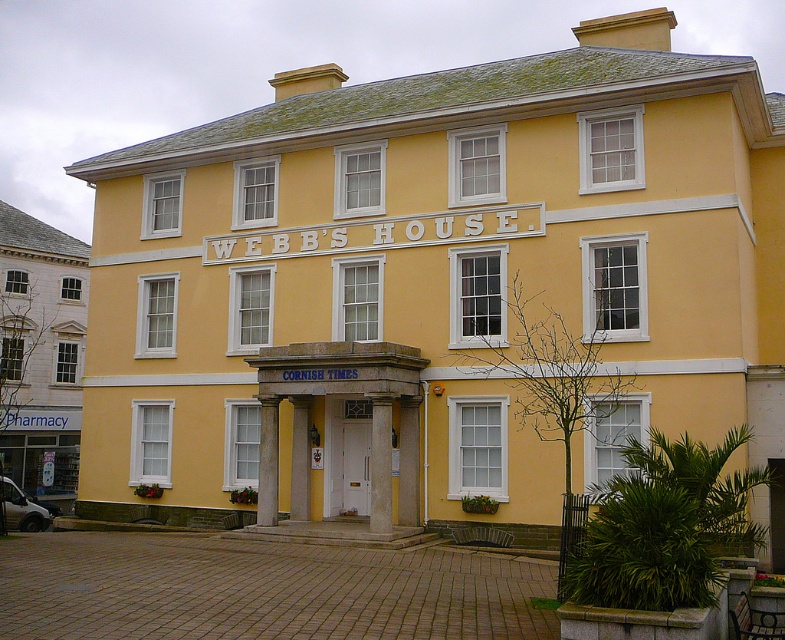
Question: Is white matte building at left below yellow matte/texture columns at center?

Choices:
 (A) no
 (B) yes

Answer: (A)

Question: Does white matte building at left come in front of yellow matte/texture columns at center?

Choices:
 (A) yes
 (B) no

Answer: (B)

Question: Which point is farther to the camera?

Choices:
 (A) white matte building at left
 (B) yellow matte/texture columns at center

Answer: (A)

Question: Which point appears closest to the camera in this image?

Choices:
 (A) (269, 499)
 (B) (31, 269)

Answer: (A)

Question: Can you confirm if white matte building at left is thinner than yellow matte/texture columns at center?

Choices:
 (A) yes
 (B) no

Answer: (B)